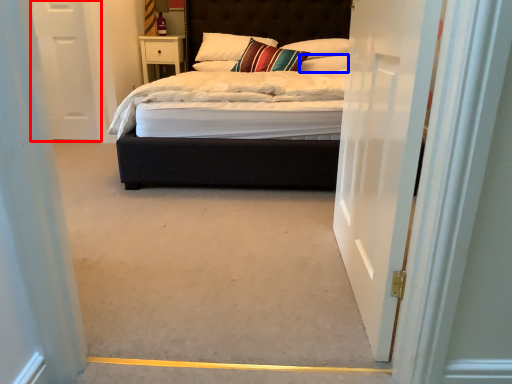
Question: Among these objects, which one is nearest to the camera, door (highlighted by a red box) or pillow (highlighted by a blue box)?

Choices:
 (A) door
 (B) pillow

Answer: (A)